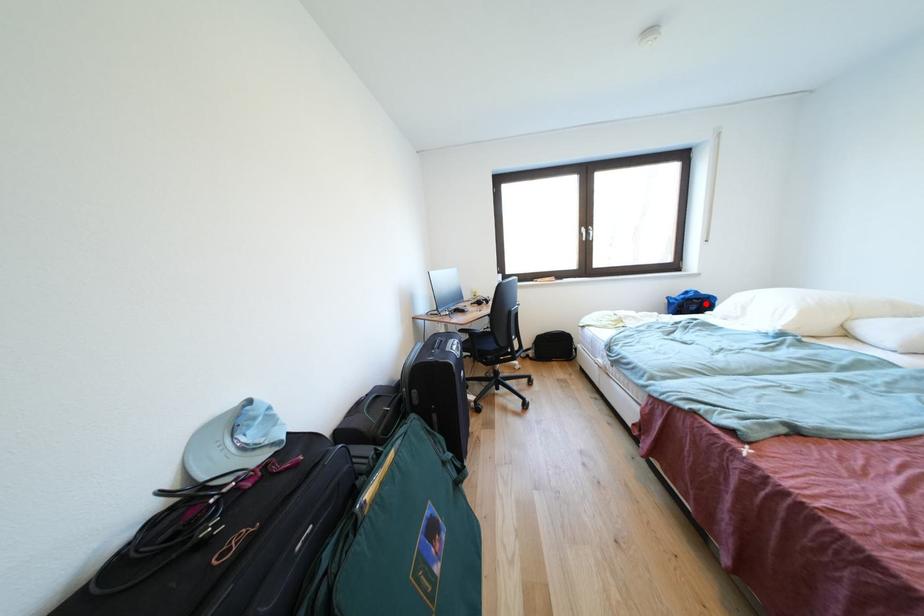
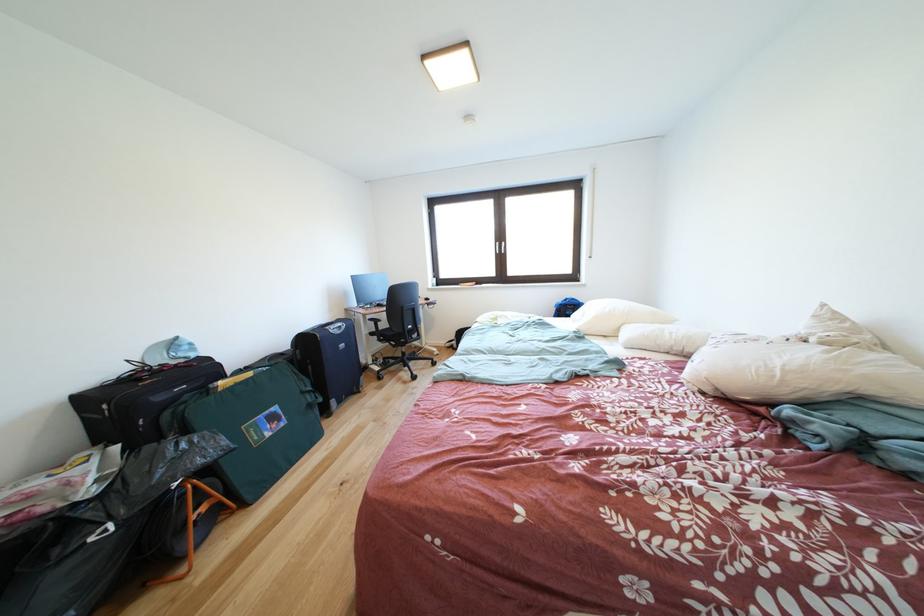
Locate, in the second image, the point that corresponds to the highlighted location in the first image.

(578, 310)